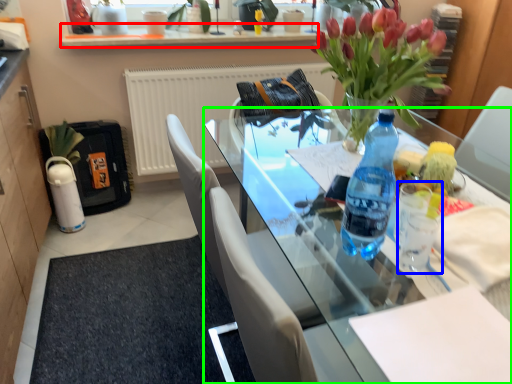
Question: Which is farther away from window sill (highlighted by a red box)? coffee cup (highlighted by a blue box) or desk (highlighted by a green box)?

Choices:
 (A) coffee cup
 (B) desk

Answer: (A)